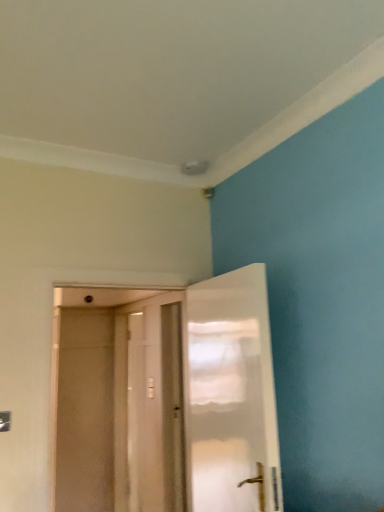
Question: Is white glossy door at center, which is the 2th door in front-to-back order, at the back of transparent plastic screen door at center?

Choices:
 (A) yes
 (B) no

Answer: (B)

Question: Is the position of transparent plastic screen door at center more distant than that of white glossy door at center, which is counted as the 1th door, starting from the back?

Choices:
 (A) no
 (B) yes

Answer: (B)

Question: Is transparent plastic screen door at center aimed at white glossy door at center, which is the 2th door in front-to-back order?

Choices:
 (A) no
 (B) yes

Answer: (A)

Question: Can you confirm if transparent plastic screen door at center is wider than white glossy door at center, which is counted as the 1th door, starting from the back?

Choices:
 (A) yes
 (B) no

Answer: (B)

Question: Considering the relative positions of transparent plastic screen door at center and white glossy door at center, which is counted as the 1th door, starting from the back, in the image provided, is transparent plastic screen door at center to the left of white glossy door at center, which is counted as the 1th door, starting from the back, from the viewer's perspective?

Choices:
 (A) no
 (B) yes

Answer: (B)

Question: Does transparent plastic screen door at center lie in front of white glossy door at center, which is counted as the 1th door, starting from the back?

Choices:
 (A) yes
 (B) no

Answer: (B)

Question: Can you confirm if transparent plastic screen door at center is positioned to the right of white matte door at center, the second door positioned from the back?

Choices:
 (A) yes
 (B) no

Answer: (B)

Question: Is the position of transparent plastic screen door at center less distant than that of white matte door at center, the second door positioned from the back?

Choices:
 (A) no
 (B) yes

Answer: (A)

Question: Is transparent plastic screen door at center positioned beyond the bounds of white matte door at center, the second door positioned from the back?

Choices:
 (A) yes
 (B) no

Answer: (A)

Question: Considering the relative sizes of transparent plastic screen door at center and white matte door at center, acting as the 1th door starting from the front, in the image provided, is transparent plastic screen door at center bigger than white matte door at center, acting as the 1th door starting from the front,?

Choices:
 (A) yes
 (B) no

Answer: (B)

Question: Is transparent plastic screen door at center thinner than white matte door at center, acting as the 1th door starting from the front?

Choices:
 (A) no
 (B) yes

Answer: (B)

Question: Is transparent plastic screen door at center positioned far away from white matte door at center, the second door positioned from the back?

Choices:
 (A) no
 (B) yes

Answer: (A)

Question: Is white glossy door at center, which is counted as the 1th door, starting from the back, shorter than transparent plastic screen door at center?

Choices:
 (A) yes
 (B) no

Answer: (A)